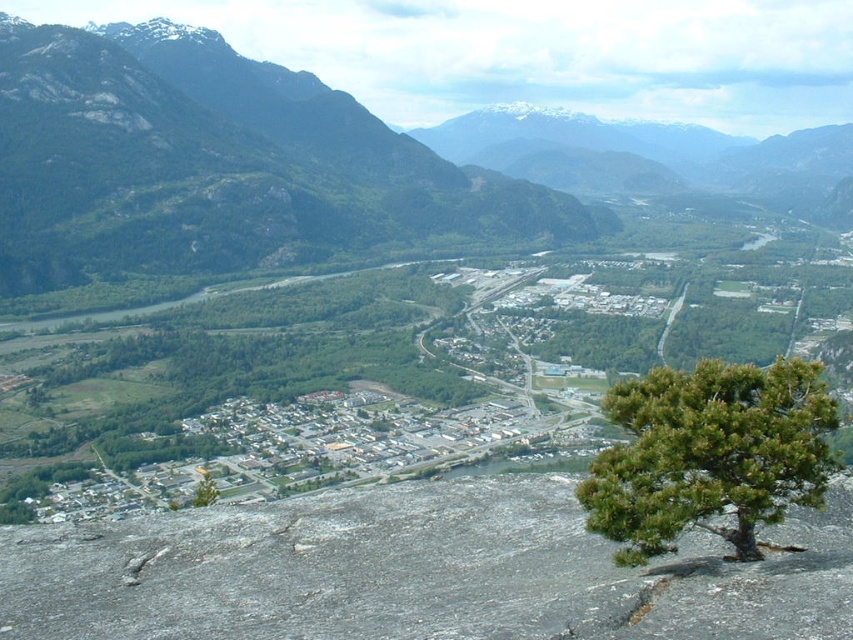
You are a landscape photographer planning to capture the valley view. You notice two trees in the lower part of the image, the green textured tree at lower right and the green matte tree at lower left. Which tree would you focus on if you want to highlight a larger portion of the scene?

The green matte tree at lower left occupies more space in the scene compared to the green textured tree at lower right, so focusing on the green matte tree at lower left would allow you to highlight a larger portion of the scene.

You are standing at the cliff edge in the image and want to take a photo of the green textured tree at lower right. To ensure the tree is centered in your camera viewfinder, where should you aim your camera? Specify the coordinates provided in the description.

The green textured tree at lower right is located at coordinates (709, 454), so you should aim your camera at that point to center it in the viewfinder.

Consider the image. You are a hiker standing at the cliff edge looking out over the valley. You notice two points marked on your map corresponding to coordinates in the scene. The first point is at coordinate point(703, 371) and the second at point(213, 481). Which of these two points is closer to your current position on the cliff edge?

Point(703, 371) is closer to the viewer than point(213, 481), so the first point is closer to your current position on the cliff edge.